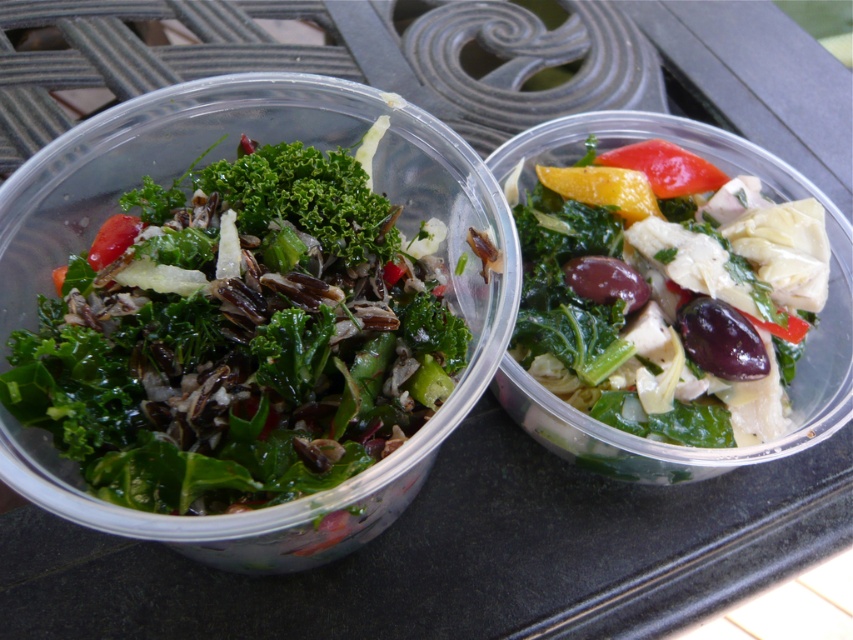
Which is in front, point (422, 397) or point (741, 332)?

Point (422, 397)

Does green leafy salad at left appear on the left side of green leafy salad at center?

Correct, you'll find green leafy salad at left to the left of green leafy salad at center.

Which is behind, point (96, 464) or point (821, 204)?

Positioned behind is point (821, 204).

This screenshot has height=640, width=853. Identify the location of green leafy salad at left. (233, 344).

Which is below, yellow matte pepper at upper center or yellow matte bell pepper at upper right?

yellow matte pepper at upper center is lower down.

Which is above, yellow matte pepper at upper center or yellow matte bell pepper at upper right?

Positioned higher is yellow matte bell pepper at upper right.

The height and width of the screenshot is (640, 853). Identify the location of yellow matte pepper at upper center. (602, 188).

In the scene shown: Does green leafy salad at center have a lesser width compared to yellow matte pepper at upper center?

Incorrect, green leafy salad at center's width is not less than yellow matte pepper at upper center's.

Which is more to the left, green leafy salad at center or yellow matte pepper at upper center?

yellow matte pepper at upper center is more to the left.

Where is `green leafy salad at center`? Image resolution: width=853 pixels, height=640 pixels. green leafy salad at center is located at coordinates (682, 321).

Locate an element on the screen. green leafy salad at center is located at coordinates (682, 321).